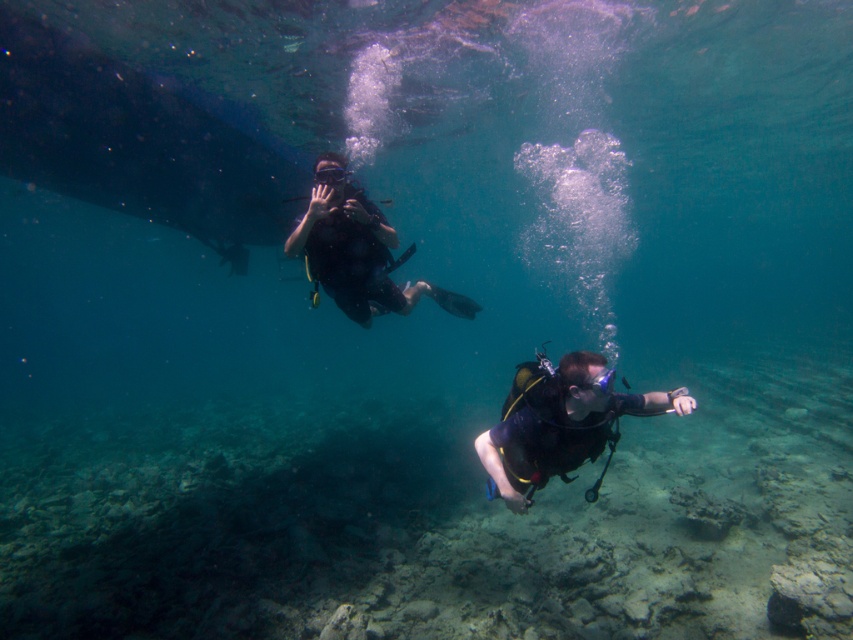
Which of these two, matte black scuba diver at center or transparent rubber goggles at upper center, stands taller?

A: matte black scuba diver at center

Identify the location of matte black scuba diver at center. The image size is (853, 640). (x=560, y=422).

I want to click on matte black scuba diver at center, so pyautogui.click(x=560, y=422).

Image resolution: width=853 pixels, height=640 pixels. I want to click on matte black scuba diver at center, so click(560, 422).

Does matte black scuba diver at center have a smaller size compared to matte black wetsuit at center?

Correct, matte black scuba diver at center occupies less space than matte black wetsuit at center.

Based on the photo, is matte black scuba diver at center below matte black wetsuit at center?

Yes.

Is point (534, 452) behind point (339, 224)?

No.

The width and height of the screenshot is (853, 640). In order to click on matte black scuba diver at center in this screenshot , I will do `click(560, 422)`.

Does matte black wetsuit at center come behind transparent rubber goggles at upper center?

No, it is not.

Does matte black wetsuit at center have a greater width compared to transparent rubber goggles at upper center?

Yes, matte black wetsuit at center is wider than transparent rubber goggles at upper center.

Is point (350, 292) positioned before point (345, 177)?

No, it is behind (345, 177).

This screenshot has width=853, height=640. In order to click on matte black wetsuit at center in this screenshot , I will do pyautogui.click(x=358, y=257).